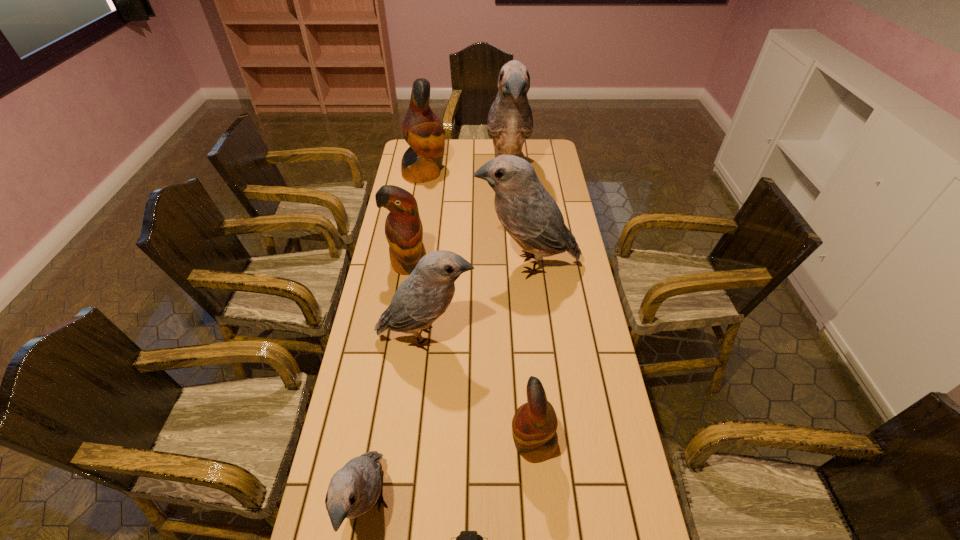
Locate an element on the screen. blank area located 0.310m on the front-facing side of the second farthest gray parrot is located at coordinates (390, 264).

Identify the location of free point located on the front-facing side of the second farthest gray parrot. This screenshot has height=540, width=960. (385, 264).

Locate an element on the screen. The width and height of the screenshot is (960, 540). free space located 0.230m on the front-facing side of the second farthest gray parrot is located at coordinates pyautogui.click(x=412, y=264).

You are a GUI agent. You are given a task and a screenshot of the screen. Output one action in this format:
    pyautogui.click(x=<x>, y=<y>)
    Task: Click on the vacant space situated 0.350m on the face of the biggest red parrot
    Image resolution: width=960 pixels, height=540 pixels.
    Given the screenshot: What is the action you would take?
    pyautogui.click(x=522, y=173)

Image resolution: width=960 pixels, height=540 pixels. Find the location of `free region located 0.160m on the face of the second smallest red parrot`. free region located 0.160m on the face of the second smallest red parrot is located at coordinates (401, 315).

In order to click on vacant space located 0.260m on the front-facing side of the second smallest gray parrot in this screenshot , I will do `click(557, 336)`.

Identify the location of vacant space located on the face of the rightmost red parrot. (471, 443).

What are the coordinates of `vacant space situated on the face of the rightmost red parrot` in the screenshot? It's located at (389, 443).

This screenshot has width=960, height=540. Identify the location of vacant region located 0.130m on the face of the rightmost red parrot. (461, 443).

Locate an element on the screen. This screenshot has height=540, width=960. object present at the far left corner is located at coordinates (422, 130).